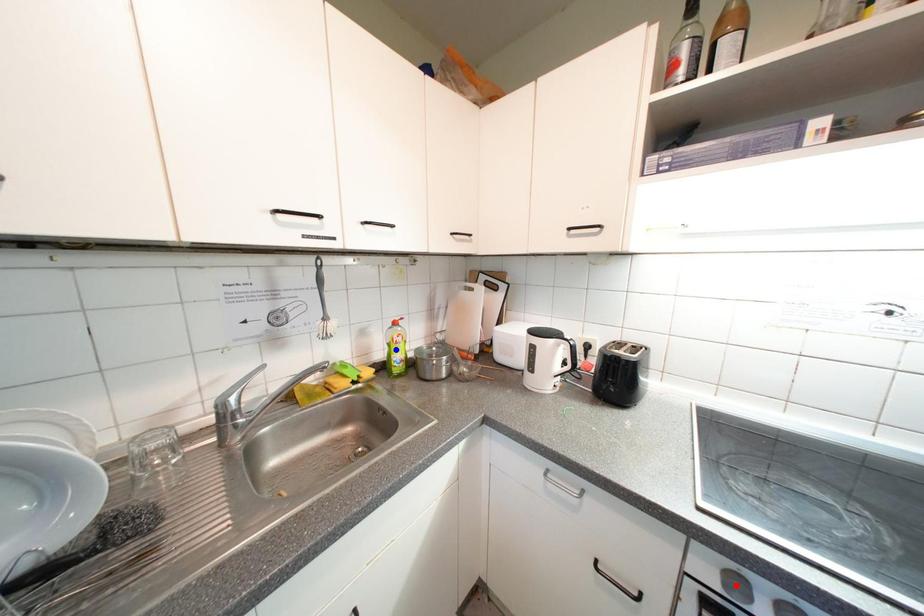
Question: In the image, two points are highlighted. Which point is nearer to the camera? Reply with the corresponding letter.

Choices:
 (A) blue point
 (B) red point

Answer: (B)